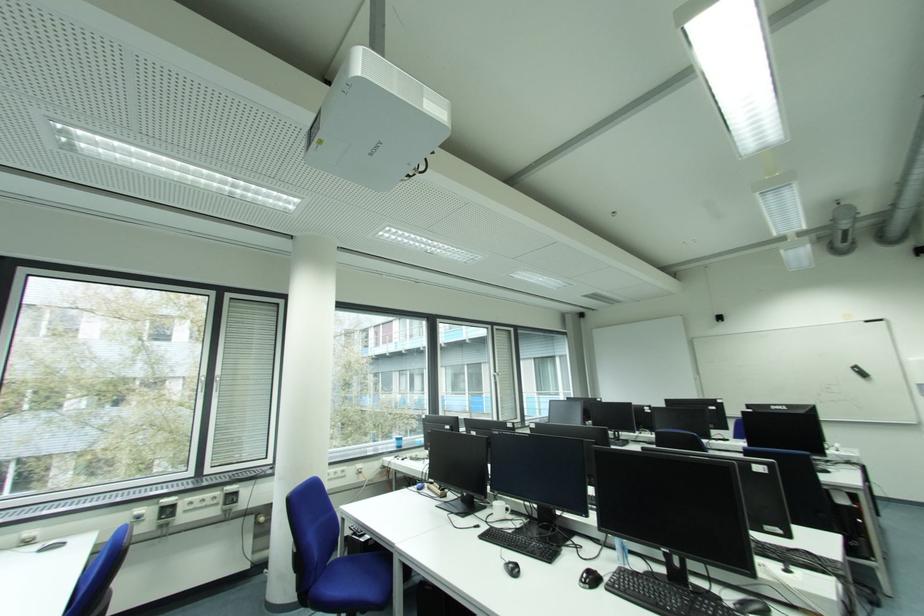
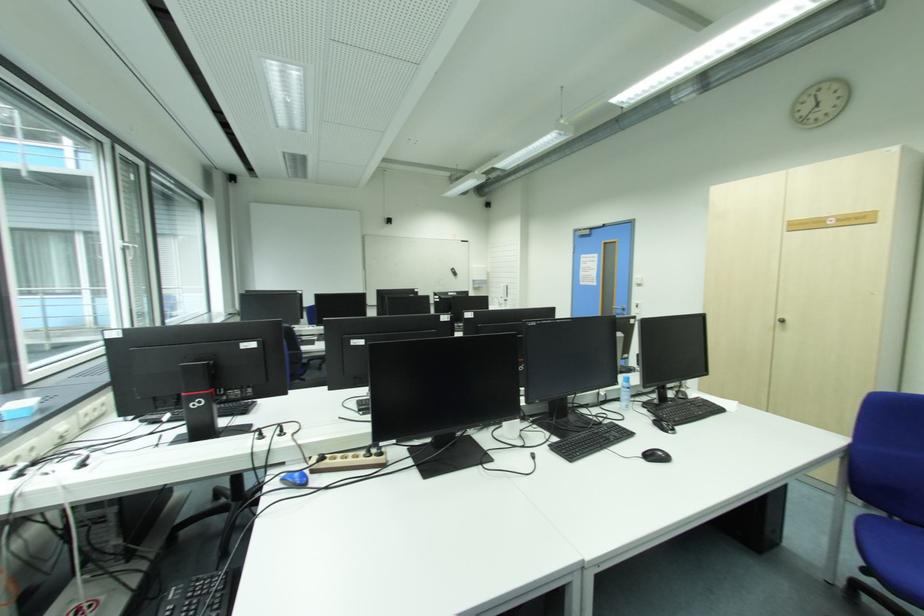
Locate, in the second image, the point that corresponds to (500,377) in the first image.

(131, 249)